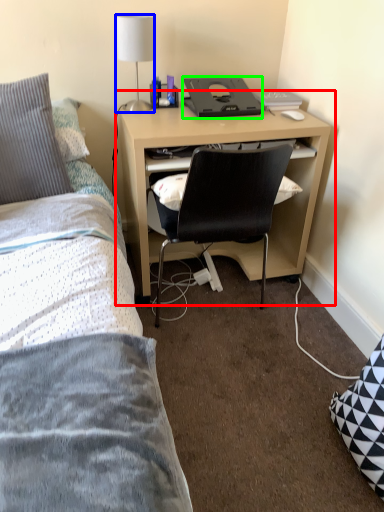
Question: Considering the real-world distances, which object is farthest from computer desk (highlighted by a red box)? lamp (highlighted by a blue box) or desktop (highlighted by a green box)?

Choices:
 (A) lamp
 (B) desktop

Answer: (A)